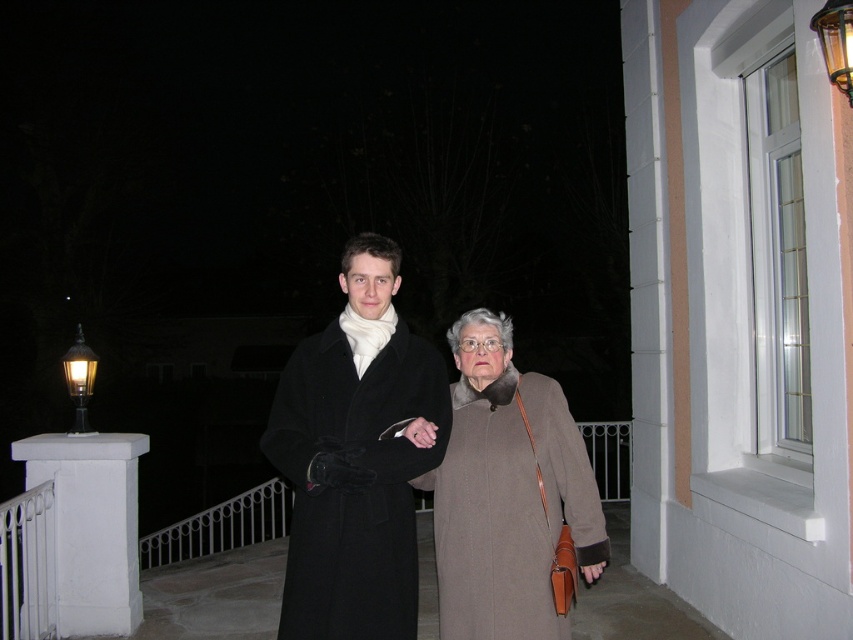
Between black wool coat at center and white painted concrete pillar at lower left, which one has less height?

Standing shorter between the two is white painted concrete pillar at lower left.

Between point (370, 480) and point (85, 515), which one is positioned behind?

Point (85, 515)

Does point (309, 394) come farther from viewer compared to point (102, 582)?

No, (309, 394) is in front of (102, 582).

The image size is (853, 640). In order to click on black wool coat at center in this screenshot , I will do `click(352, 483)`.

Between black wool coat at center and brown wool coat at center, which one appears on the right side from the viewer's perspective?

Positioned to the right is brown wool coat at center.

Does black wool coat at center come behind brown wool coat at center?

No.

Does point (438, 438) come closer to viewer compared to point (558, 497)?

Yes, point (438, 438) is in front of point (558, 497).

Locate an element on the screen. This screenshot has height=640, width=853. black wool coat at center is located at coordinates (352, 483).

Does black wool coat at center have a larger size compared to matte black coat at center?

Actually, black wool coat at center might be smaller than matte black coat at center.

Between point (357, 582) and point (360, 272), which one is positioned in front?

Point (357, 582)

Image resolution: width=853 pixels, height=640 pixels. In order to click on black wool coat at center in this screenshot , I will do `click(352, 483)`.